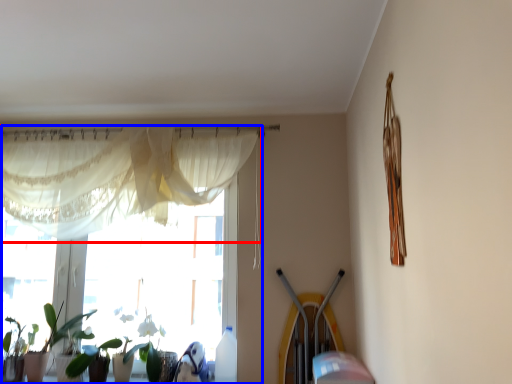
Question: Which of the following is the closest to the observer, curtain (highlighted by a red box) or window (highlighted by a blue box)?

Choices:
 (A) curtain
 (B) window

Answer: (A)